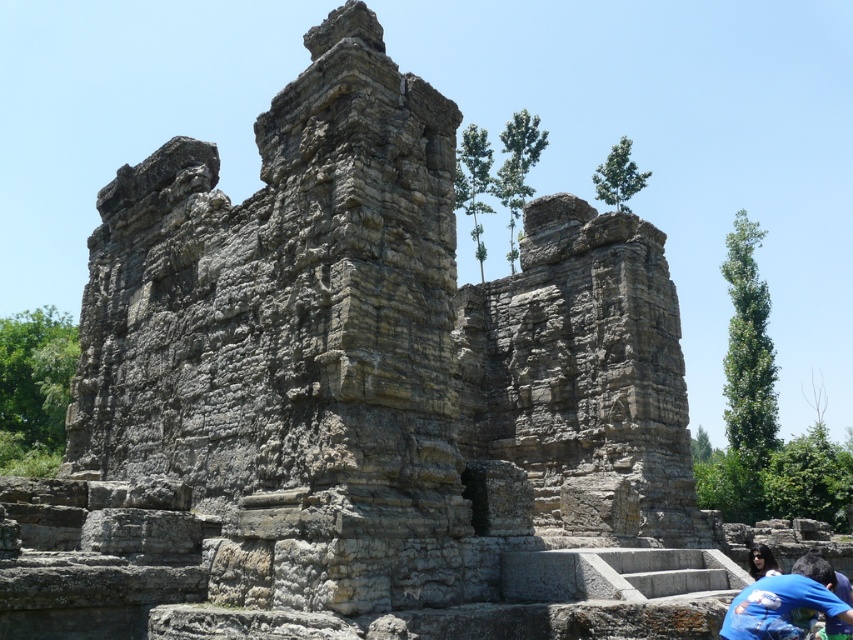
Does blue fabric shirt at lower right lie behind dark blue fabric at lower right?

That is False.

Based on the photo, does blue fabric shirt at lower right have a lesser width compared to dark blue fabric at lower right?

Yes, blue fabric shirt at lower right is thinner than dark blue fabric at lower right.

Between point (799, 577) and point (747, 552), which one is positioned in front?

Point (799, 577) is in front.

Where is `blue fabric shirt at lower right`? This screenshot has height=640, width=853. blue fabric shirt at lower right is located at coordinates (785, 604).